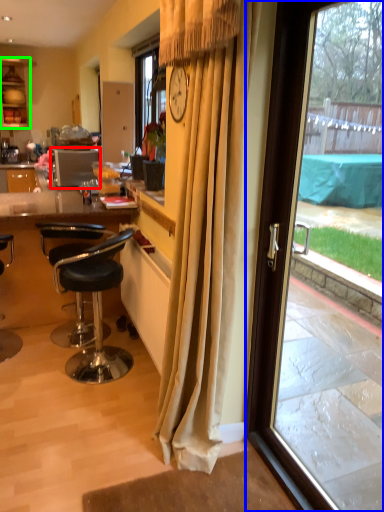
Question: Considering the real-world distances, which object is closest to kitchen appliance (highlighted by a red box)? door (highlighted by a blue box) or cabinetry (highlighted by a green box).

Choices:
 (A) door
 (B) cabinetry

Answer: (B)